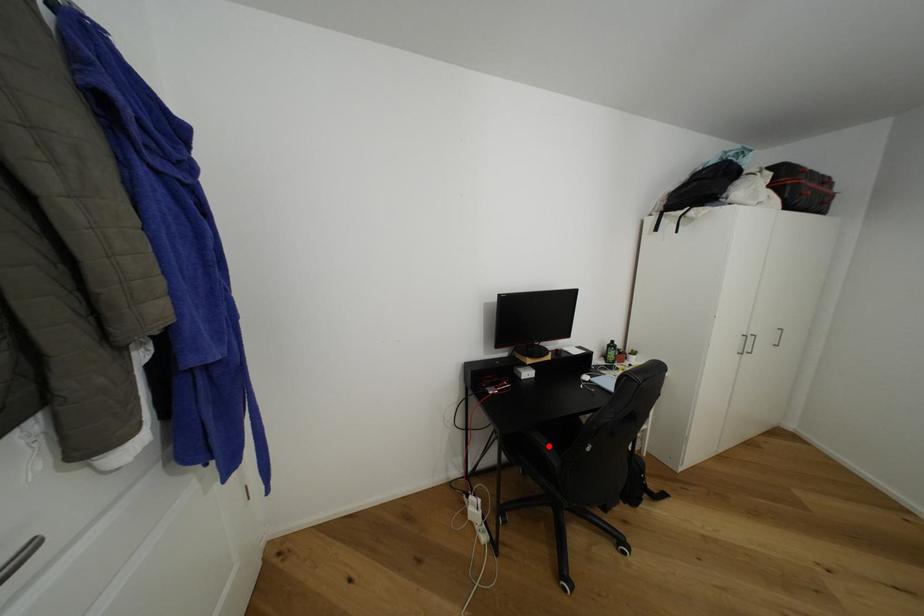
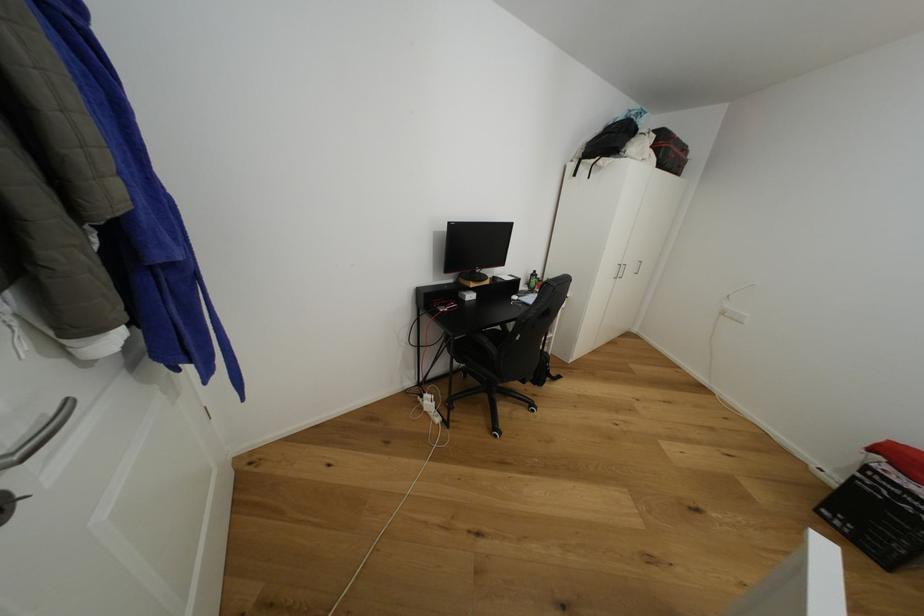
Question: I am providing you with two images of the same scene from different viewpoints. A red point is shown in image1. For the corresponding object point in image2, is it positioned nearer or farther from the camera?

Choices:
 (A) Nearer
 (B) Farther

Answer: (B)